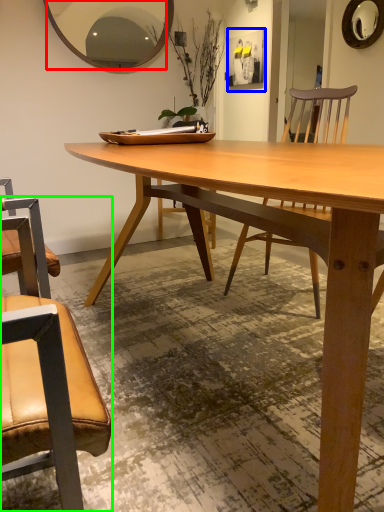
Question: Which object is the closest to the mirror (highlighted by a red box)? Choose among these: picture frame (highlighted by a blue box) or chair (highlighted by a green box).

Choices:
 (A) picture frame
 (B) chair

Answer: (B)